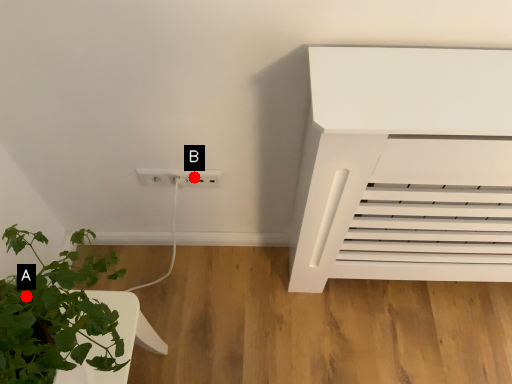
Question: Two points are circled on the image, labeled by A and B beside each circle. Which point is farther to the camera?

Choices:
 (A) A is further
 (B) B is further

Answer: (B)